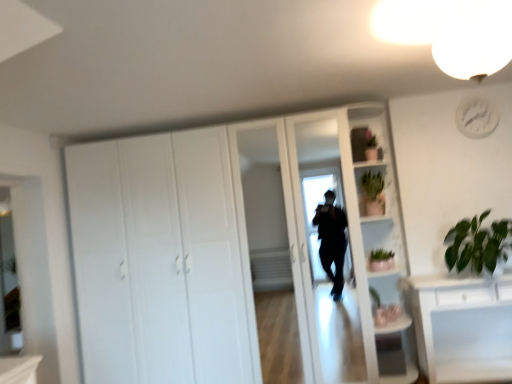
Question: Considering the relative sizes of white matte cupboard at center and green matte plant at right in the image provided, is white matte cupboard at center smaller than green matte plant at right?

Choices:
 (A) no
 (B) yes

Answer: (A)

Question: Is white matte cupboard at center in front of green matte plant at right?

Choices:
 (A) no
 (B) yes

Answer: (B)

Question: Is white matte cupboard at center far away from green matte plant at right?

Choices:
 (A) no
 (B) yes

Answer: (B)

Question: Does white matte cupboard at center have a greater width compared to green matte plant at right?

Choices:
 (A) yes
 (B) no

Answer: (A)

Question: From a real-world perspective, is white matte cupboard at center physically below green matte plant at right?

Choices:
 (A) no
 (B) yes

Answer: (A)

Question: Is green matte plant at right located within white matte cupboard at center?

Choices:
 (A) yes
 (B) no

Answer: (B)

Question: Are white plastic clock at upper right and white glossy bookshelf at upper right located far from each other?

Choices:
 (A) no
 (B) yes

Answer: (B)

Question: From a real-world perspective, is white plastic clock at upper right positioned under white glossy bookshelf at upper right based on gravity?

Choices:
 (A) yes
 (B) no

Answer: (B)

Question: Considering the relative sizes of white plastic clock at upper right and white glossy bookshelf at upper right in the image provided, is white plastic clock at upper right shorter than white glossy bookshelf at upper right?

Choices:
 (A) no
 (B) yes

Answer: (B)

Question: From the image's perspective, is white plastic clock at upper right located above white glossy bookshelf at upper right?

Choices:
 (A) yes
 (B) no

Answer: (A)

Question: Is white plastic clock at upper right positioned before white glossy bookshelf at upper right?

Choices:
 (A) no
 (B) yes

Answer: (A)

Question: Is white plastic clock at upper right facing towards white glossy bookshelf at upper right?

Choices:
 (A) no
 (B) yes

Answer: (A)

Question: From a real-world perspective, is green matte cactus at upper right, the first cabinet viewed from the back, on top of white plastic clock at upper right?

Choices:
 (A) yes
 (B) no

Answer: (B)